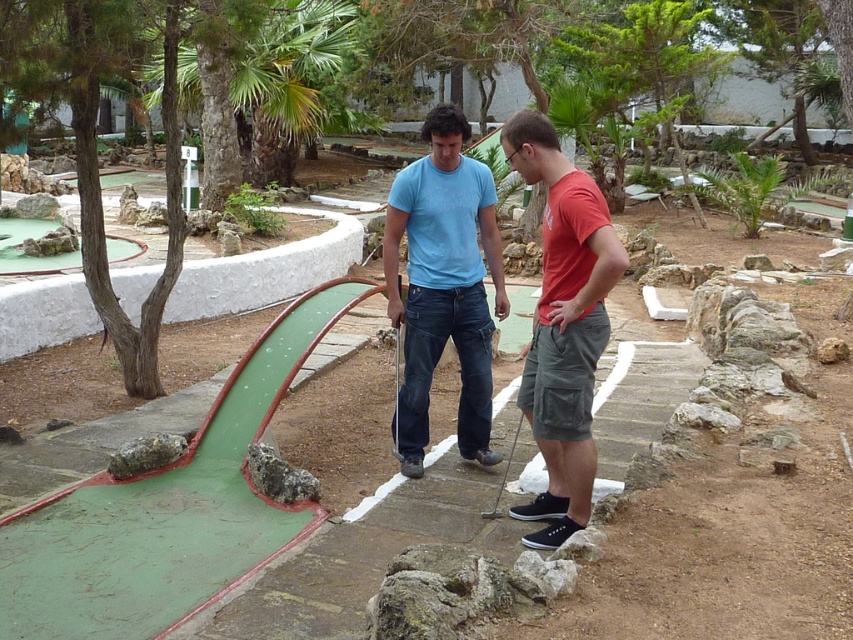
You are playing mini golf and need to place a 2 meter long flag at the center of the matte blue jeans at center. Is the flag too long to fit within the 5 meter boundary marked by white lines in the scene?

The matte blue jeans at center is 4.60 meters away from the camera. Since the flag is 2 meters long, placing it at the center would require a total space of 4.60 meters plus 1 meter on each side, totaling 6.60 meters. This exceeds the 5 meter boundary, so the flag is too long to fit within the marked area.